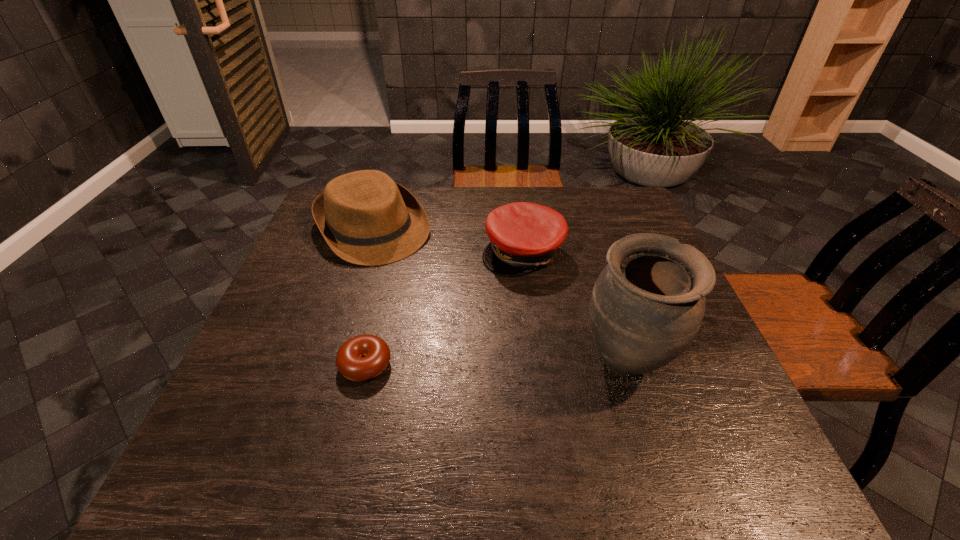
The height and width of the screenshot is (540, 960). Find the location of `vacant point located between the urn and the shortest object`. vacant point located between the urn and the shortest object is located at coordinates (495, 364).

At what (x,y) coordinates should I click in order to perform the action: click on free space between the tallest object and the second tallest object. Please return your answer as a coordinate pair (x, y). The height and width of the screenshot is (540, 960). Looking at the image, I should click on (499, 296).

The height and width of the screenshot is (540, 960). I want to click on free point between the fedora and the tallest object, so click(499, 296).

Choose which object is the nearest neighbor to the tallest object. Please provide its 2D coordinates. Your answer should be formatted as a tuple, i.e. [(x, y)], where the tuple contains the x and y coordinates of a point satisfying the conditions above.

[(524, 236)]

Locate which object ranks second in proximity to the shortest object. Please provide its 2D coordinates. Your answer should be formatted as a tuple, i.e. [(x, y)], where the tuple contains the x and y coordinates of a point satisfying the conditions above.

[(524, 236)]

I want to click on blank area in the image that satisfies the following two spatial constraints: 1. on the front side of the second tallest object; 2. on the left side of the doughnut, so click(x=328, y=364).

Locate an element on the screen. The width and height of the screenshot is (960, 540). vacant space that satisfies the following two spatial constraints: 1. on the front side of the doughnut; 2. on the right side of the second tallest object is located at coordinates (328, 364).